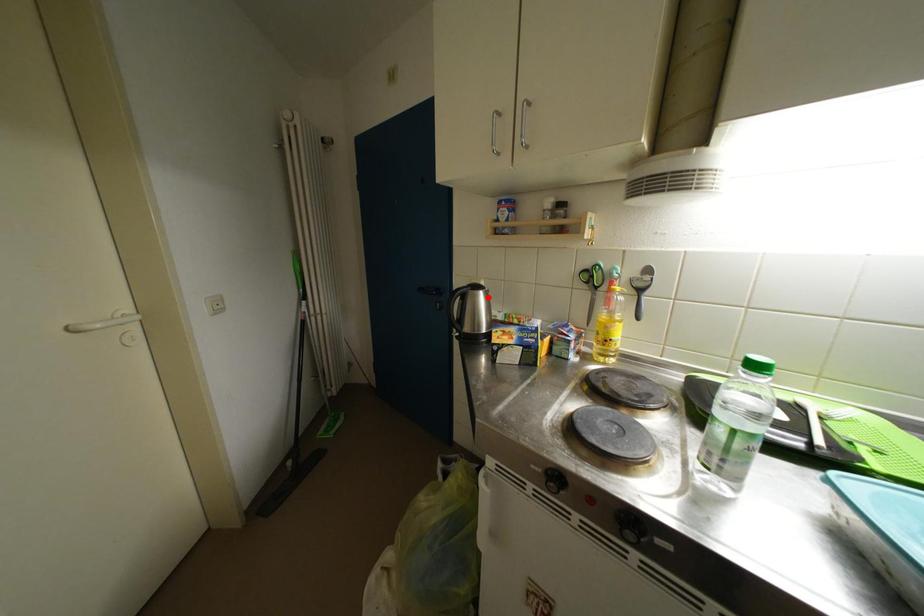
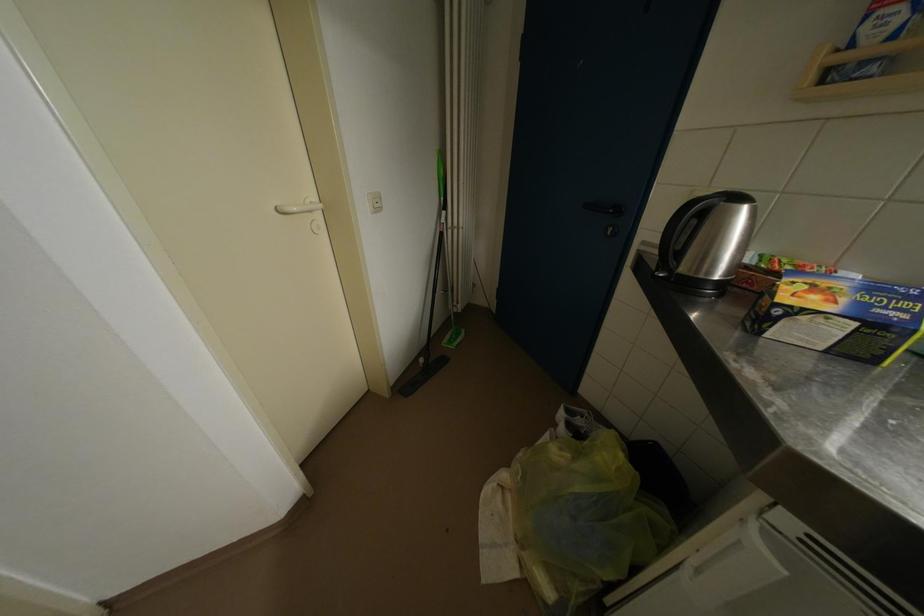
Question: I am providing you with two images of the same scene from different viewpoints. A red point is marked on the first image. At the location where the point appears in image 1, is it still visible in image 2?

Choices:
 (A) Yes
 (B) No

Answer: (A)